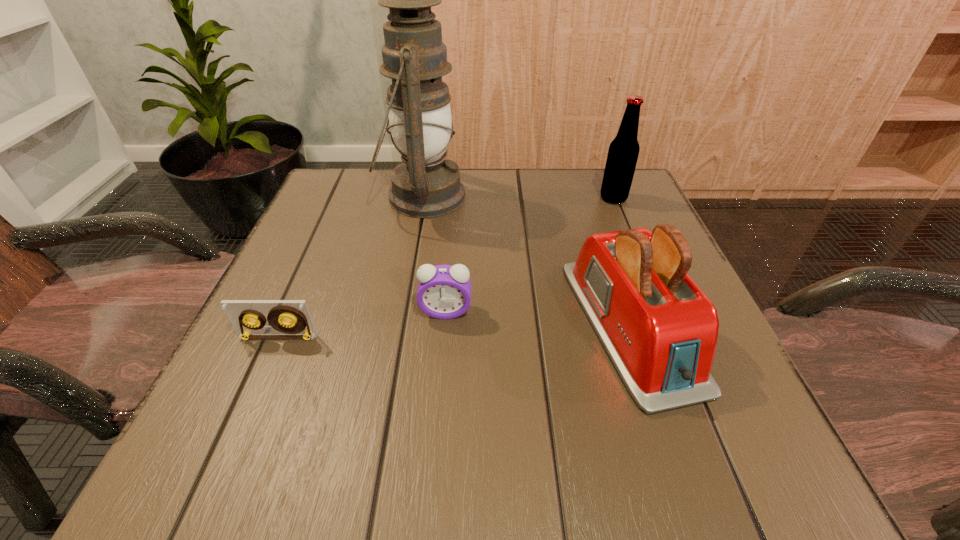
Locate an element on the screen. vacant area that lies between the toaster and the oil lamp is located at coordinates [526, 261].

At what (x,y) coordinates should I click in order to perform the action: click on free space between the alarm clock and the leftmost object. Please return your answer as a coordinate pair (x, y). This screenshot has width=960, height=540. Looking at the image, I should click on (362, 325).

Locate an element on the screen. This screenshot has width=960, height=540. empty space between the leftmost object and the third tallest object is located at coordinates point(454,331).

Locate an element on the screen. The height and width of the screenshot is (540, 960). free space between the fourth tallest object and the toaster is located at coordinates (538, 318).

Select which object appears as the closest to the tallest object. Please provide its 2D coordinates. Your answer should be formatted as a tuple, i.e. [(x, y)], where the tuple contains the x and y coordinates of a point satisfying the conditions above.

[(444, 291)]

Identify which object is the nearest to the oil lamp. Please provide its 2D coordinates. Your answer should be formatted as a tuple, i.e. [(x, y)], where the tuple contains the x and y coordinates of a point satisfying the conditions above.

[(444, 291)]

At what (x,y) coordinates should I click in order to perform the action: click on free space that satisfies the following two spatial constraints: 1. on the front side of the oil lamp; 2. on the right side of the third tallest object. Please return your answer as a coordinate pair (x, y). This screenshot has height=540, width=960. Looking at the image, I should click on (400, 325).

Locate an element on the screen. The image size is (960, 540). free space that satisfies the following two spatial constraints: 1. on the face of the alarm clock; 2. on the right side of the third shortest object is located at coordinates (444, 325).

The image size is (960, 540). Find the location of `vacant space that satisfies the following two spatial constraints: 1. on the back side of the toaster; 2. on the left side of the beer bottle`. vacant space that satisfies the following two spatial constraints: 1. on the back side of the toaster; 2. on the left side of the beer bottle is located at coordinates (588, 198).

You are a GUI agent. You are given a task and a screenshot of the screen. Output one action in this format:
    pyautogui.click(x=<x>, y=<y>)
    Task: Click on the vacant region that satisfies the following two spatial constraints: 1. on the face of the alarm clock; 2. on the right side of the toaster
    
    Given the screenshot: What is the action you would take?
    pyautogui.click(x=444, y=325)